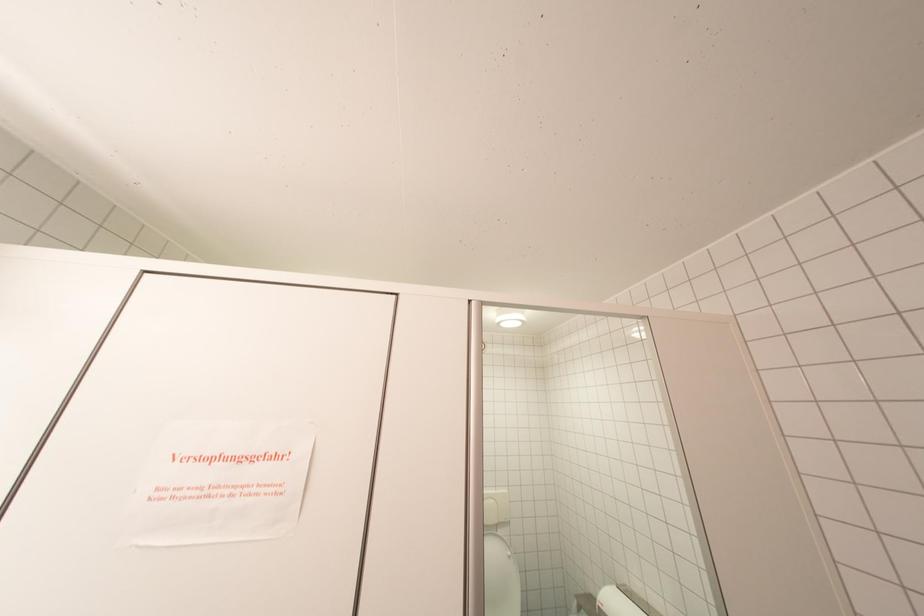
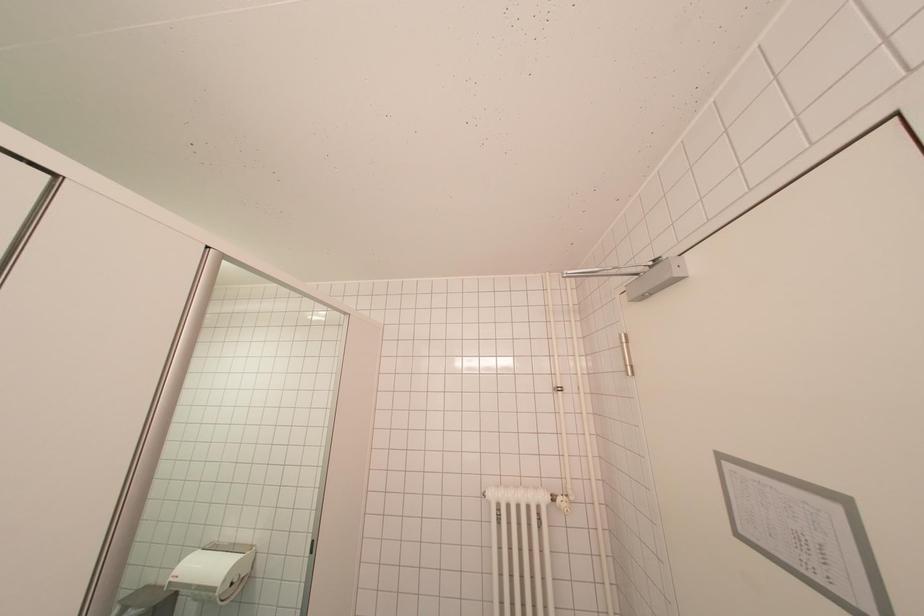
Question: The camera is either moving clockwise (left) or counter-clockwise (right) around the object. The first image is from the beginning of the video and the second image is from the end. Is the camera moving left or right when shooting the video?

Choices:
 (A) Left
 (B) Right

Answer: (A)